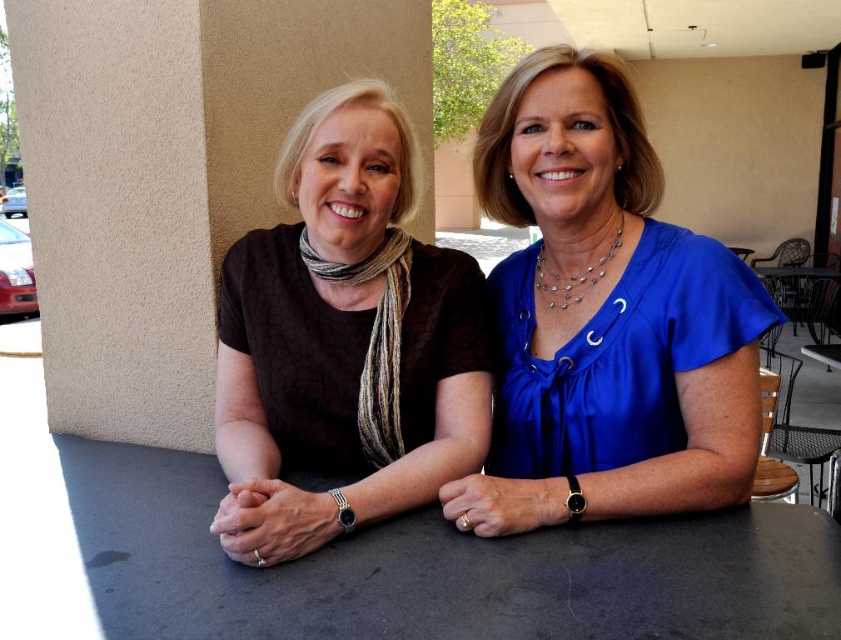
You are a photographer adjusting your camera to focus on the blue silk blouse at center. The camera can only focus on objects within a 0.1 unit radius around the point specified. Is the blue silk blouse at center within the focus range of the camera set to point [606,317]?

Yes, the point [606,317] marks the blue silk blouse at center, so the camera will focus on it within the specified radius.

You are a fashion designer observing two blouses displayed on mannequins at a fashion show. The blue silk blouse at center and the matte brown blouse at center are placed side by side. Based on their appearance, which blouse would you say is taller?

The blue silk blouse at center is taller than the matte brown blouse at center.